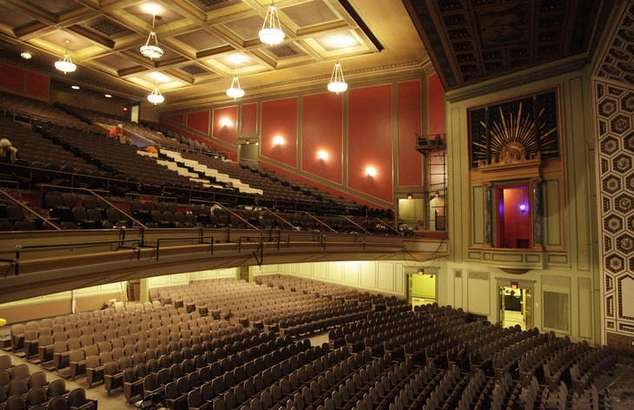
The height and width of the screenshot is (410, 634). What are the coordinates of `handrails` in the screenshot? It's located at (39, 216), (96, 196), (224, 208), (276, 214), (312, 212), (342, 213), (376, 215).